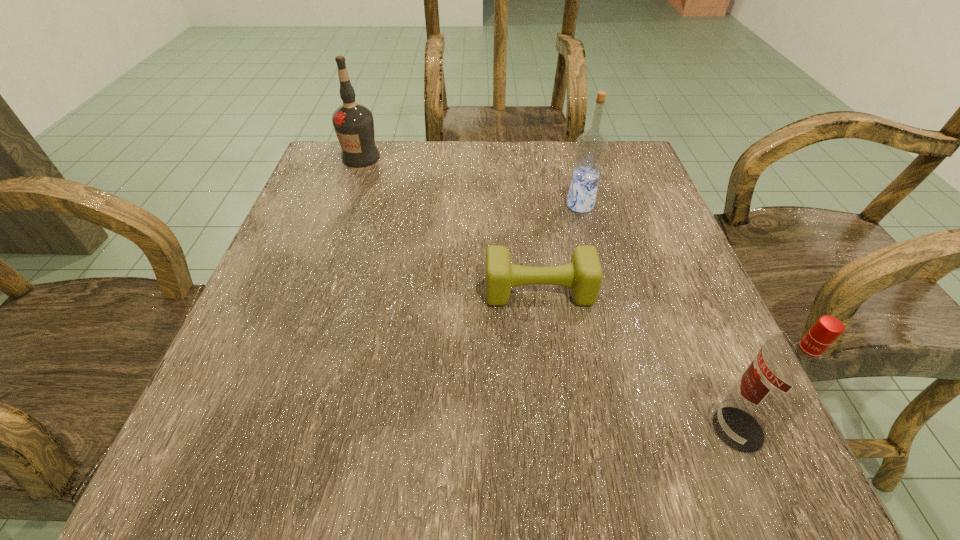
In the image, there is a desktop. What are the coordinates of `vacant space at the near edge` in the screenshot? It's located at (320, 475).

In the image, there is a desktop. Where is `free space at the left edge`? The image size is (960, 540). free space at the left edge is located at coordinates [334, 294].

The height and width of the screenshot is (540, 960). In the image, there is a desktop. What are the coordinates of `vacant space at the right edge` in the screenshot? It's located at (661, 271).

Locate an element on the screen. The image size is (960, 540). free space at the near left corner of the desktop is located at coordinates (275, 455).

The image size is (960, 540). Find the location of `unoccupied area between the shortest object and the second farthest vodka`. unoccupied area between the shortest object and the second farthest vodka is located at coordinates (560, 248).

Identify the location of vacant area that lies between the rightmost object and the farthest vodka. The image size is (960, 540). (549, 293).

Identify the location of empty space that is in between the second nearest vodka and the leftmost object. The image size is (960, 540). (470, 181).

The image size is (960, 540). In order to click on free space between the nearest vodka and the shortest object in this screenshot , I will do pos(638,360).

Locate an element on the screen. The image size is (960, 540). vacant area that lies between the second farthest object and the leftmost object is located at coordinates (470, 181).

Where is `free area in between the leftmost object and the second nearest vodka`? The width and height of the screenshot is (960, 540). free area in between the leftmost object and the second nearest vodka is located at coordinates (470, 181).